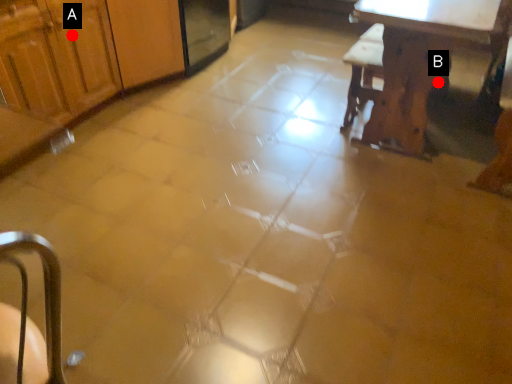
Question: Two points are circled on the image, labeled by A and B beside each circle. Among these points, which one is nearest to the camera?

Choices:
 (A) A is closer
 (B) B is closer

Answer: (A)